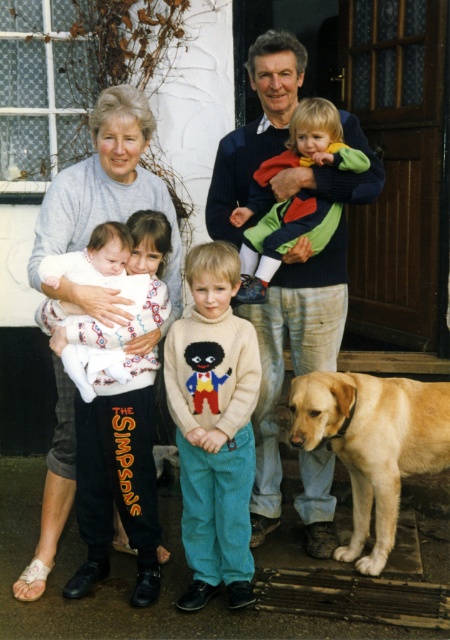
You are standing in front of the house and want to take a photo of the point at coordinates point (274, 173). If you are currently 3.5 meters away from the house, should you move closer or farther away to reach the desired point?

The point (274, 173) is 3.70 meters away from the camera. Since you are currently 3.5 meters away from the house, you need to move 0.2 meters closer to reach the desired point.

In the family photo, there are two adults wearing sweaters. The gray sweater at left and the green corduroy sweater at center. Which adult is wearing a wider sweater?

The green corduroy sweater at center is wider than the gray sweater at left.

What is the color of the object located at coordinates point (292, 196)?

The object at point (292, 196) is a green corduroy sweater.